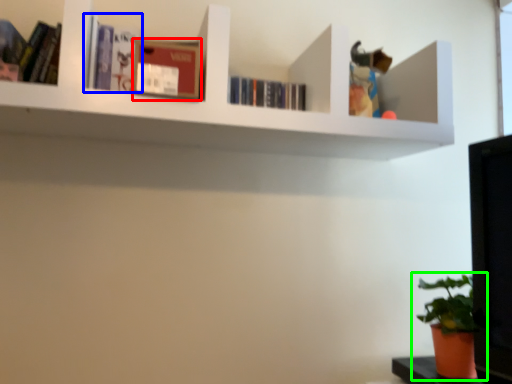
Question: Which object is positioned closest to paperback book (highlighted by a red box)? Select from book (highlighted by a blue box) and houseplant (highlighted by a green box).

Choices:
 (A) book
 (B) houseplant

Answer: (A)